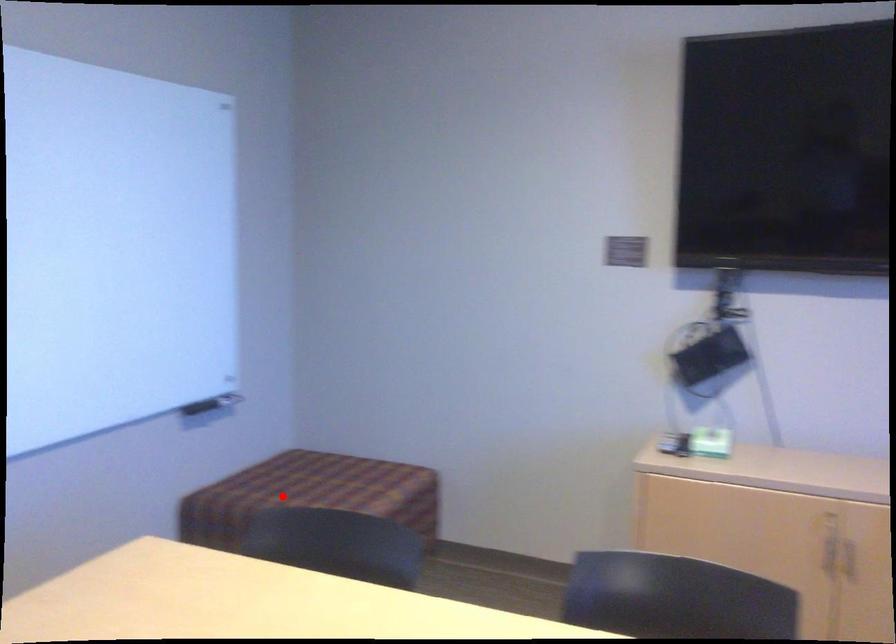
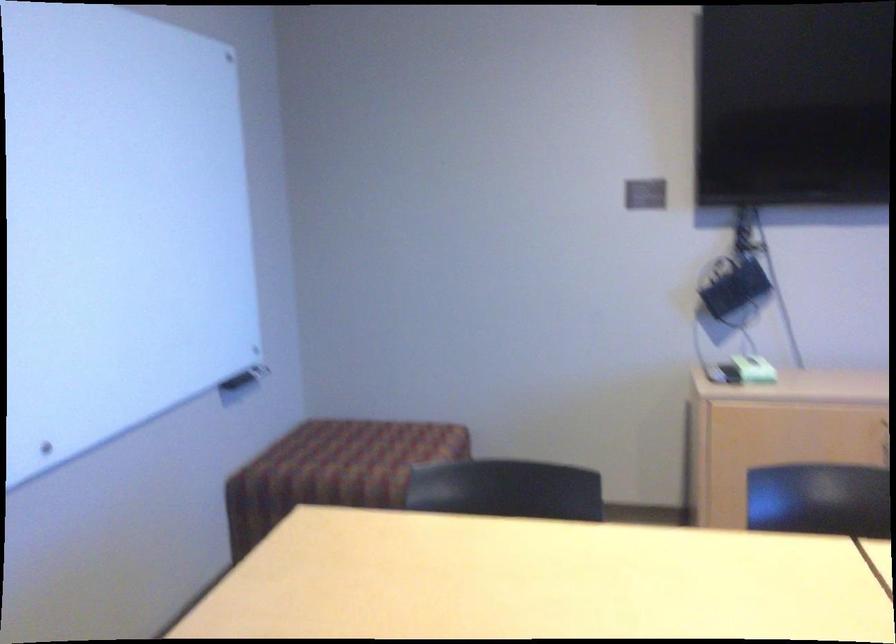
Find the pixel in the second image that matches the highlighted location in the first image.

(331, 465)